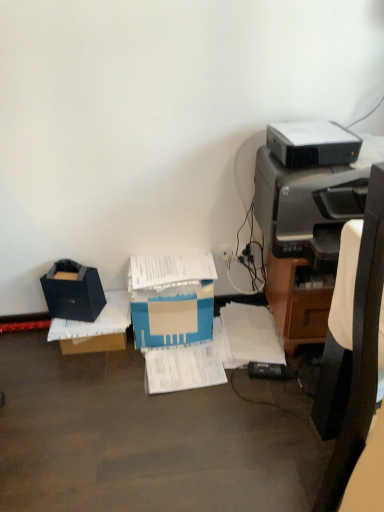
Question: Considering the positions of white paper at center, placed as the 1th document when sorted from left to right, and black plastic printer at right, which ranks as the 2th printer in top-to-bottom order, in the image, is white paper at center, placed as the 1th document when sorted from left to right, bigger or smaller than black plastic printer at right, which ranks as the 2th printer in top-to-bottom order,?

Choices:
 (A) small
 (B) big

Answer: (A)

Question: From the image's perspective, is white paper at center, which is the second document from right to left, located above or below black plastic printer at right, which ranks as the 2th printer in top-to-bottom order?

Choices:
 (A) below
 (B) above

Answer: (A)

Question: Based on their relative distances, which object is nearer to the matte black storage box at left, the 2th storage box positioned from the top?

Choices:
 (A) black fabric bag at left, which is counted as the second storage box, starting from the bottom
 (B) blue cardboard box at center
 (C) matte black printer at right
 (D) white paper at lower right, positioned as the first document in right-to-left order
 (E) black plastic chair at right

Answer: (A)

Question: Which object is the closest to the blue cardboard box at center?

Choices:
 (A) matte black storage box at left, which is counted as the first storage box, starting from the bottom
 (B) black plastic chair at right
 (C) black fabric bag at left, which is counted as the second storage box, starting from the bottom
 (D) matte black printer at right
 (E) white paper at lower right, positioned as the first document in right-to-left order

Answer: (A)